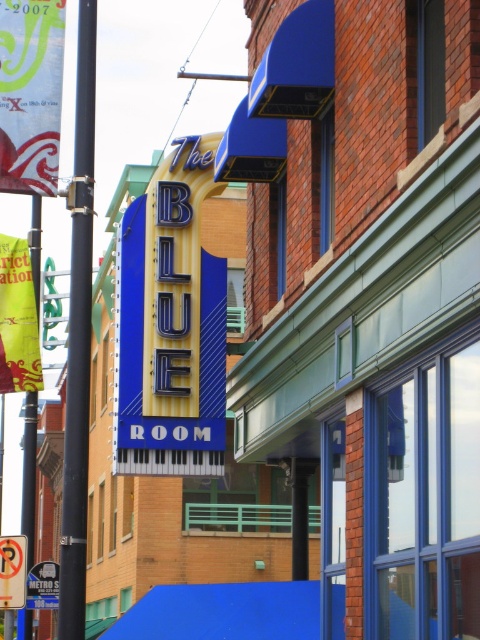
You are standing on the sidewalk in front of The Blue Room. You see a black metal pole at left and a green fabric sign at upper left. Which object is higher up from the ground?

The green fabric sign at upper left is higher up from the ground than the black metal pole at left.

You are a city planner assessing the street layout. You see the black metal pole at left and the yellow fabric sign at left. Which object is taller?

The black metal pole at left is taller than the yellow fabric sign at left according to the description provided.